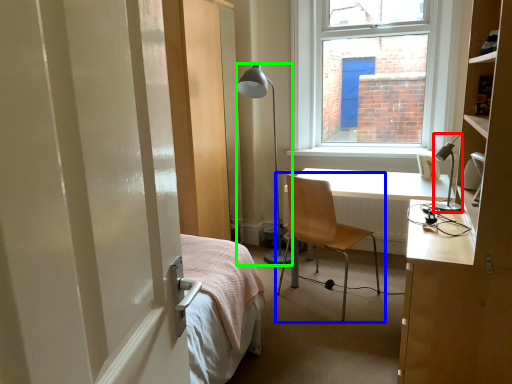
Question: Based on their relative distances, which object is nearer to lamp (highlighted by a red box)? Choose from chair (highlighted by a blue box) and lamp (highlighted by a green box).

Choices:
 (A) chair
 (B) lamp

Answer: (A)